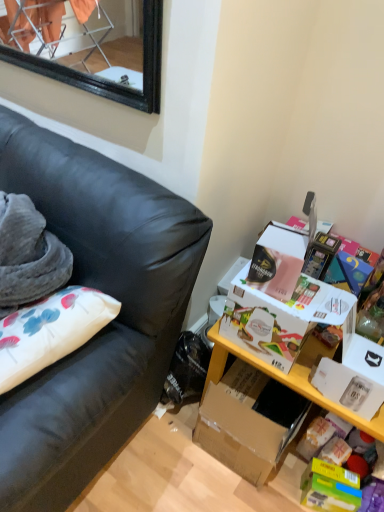
Question: Is point (59, 145) positioned closer to the camera than point (281, 376)?

Choices:
 (A) closer
 (B) farther

Answer: (B)

Question: Considering their positions, is black leather couch at left located in front of or behind yellow wood table at lower right?

Choices:
 (A) front
 (B) behind

Answer: (A)

Question: Which object is the farthest from the black leather couch at left?

Choices:
 (A) white cardboard box at right
 (B) yellow wood table at lower right

Answer: (B)

Question: Which of these objects is positioned farthest from the black leather couch at left?

Choices:
 (A) yellow wood table at lower right
 (B) white cardboard box at right

Answer: (A)